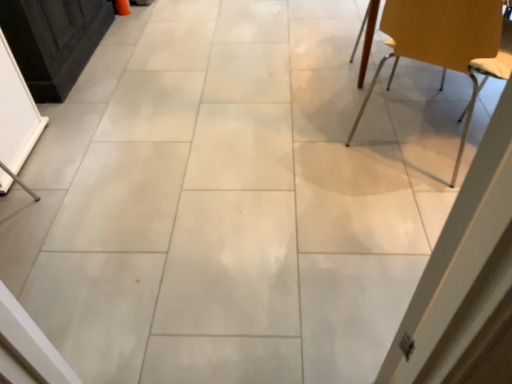
The height and width of the screenshot is (384, 512). Find the location of `free space that is to the left of wooden chair at right`. free space that is to the left of wooden chair at right is located at coordinates (308, 119).